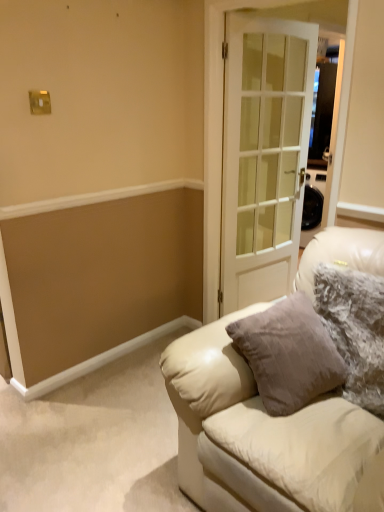
Question: Does leather couch at center appear on the left side of white glass door at center?

Choices:
 (A) no
 (B) yes

Answer: (B)

Question: Does leather couch at center have a larger size compared to white glass door at center?

Choices:
 (A) yes
 (B) no

Answer: (A)

Question: Can you confirm if leather couch at center is wider than white glass door at center?

Choices:
 (A) yes
 (B) no

Answer: (A)

Question: Considering the relative sizes of leather couch at center and white glass door at center in the image provided, is leather couch at center taller than white glass door at center?

Choices:
 (A) yes
 (B) no

Answer: (B)

Question: Is leather couch at center positioned in front of white glass door at center?

Choices:
 (A) yes
 (B) no

Answer: (A)

Question: Is fuzzy fabric pillow at right wider or thinner than leather couch at center?

Choices:
 (A) thin
 (B) wide

Answer: (A)

Question: From a real-world perspective, relative to leather couch at center, is fuzzy fabric pillow at right vertically above or below?

Choices:
 (A) below
 (B) above

Answer: (B)

Question: From their relative heights in the image, would you say fuzzy fabric pillow at right is taller or shorter than leather couch at center?

Choices:
 (A) short
 (B) tall

Answer: (A)

Question: Considering their positions, is fuzzy fabric pillow at right located in front of or behind leather couch at center?

Choices:
 (A) behind
 (B) front

Answer: (A)

Question: Is point (200, 500) positioned closer to the camera than point (365, 403)?

Choices:
 (A) closer
 (B) farther

Answer: (B)

Question: From a real-world perspective, is leather couch at center positioned above or below fuzzy fabric pillow at right?

Choices:
 (A) above
 (B) below

Answer: (B)

Question: Based on their sizes in the image, would you say leather couch at center is bigger or smaller than fuzzy fabric pillow at right?

Choices:
 (A) big
 (B) small

Answer: (A)

Question: Is leather couch at center inside the boundaries of fuzzy fabric pillow at right, or outside?

Choices:
 (A) outside
 (B) inside

Answer: (A)

Question: From the image's perspective, is white glass door at center located above or below leather couch at center?

Choices:
 (A) below
 (B) above

Answer: (B)

Question: Is white glass door at center wider or thinner than leather couch at center?

Choices:
 (A) wide
 (B) thin

Answer: (B)